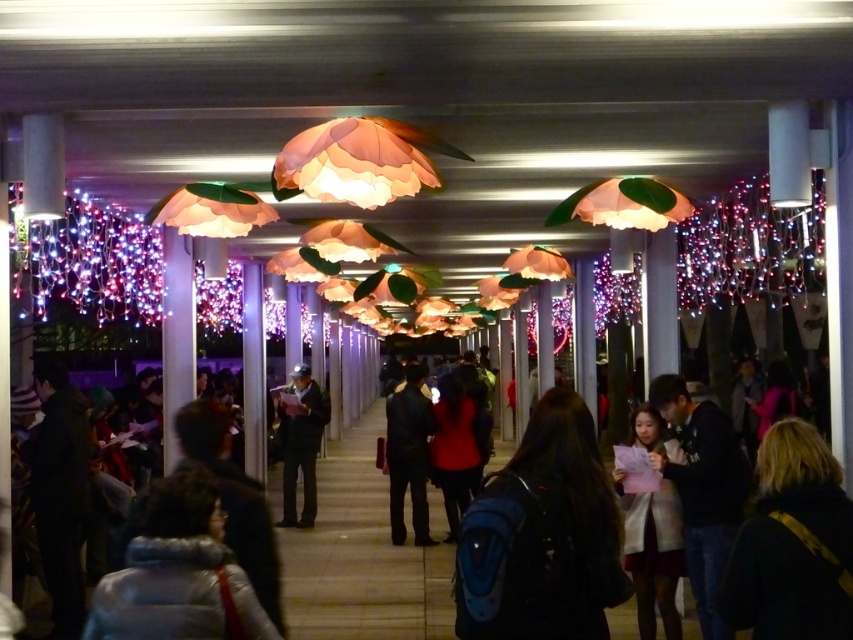
Which is more to the left, white puffy jacket at lower left or white matte coat at center?

Positioned to the left is white puffy jacket at lower left.

Is white puffy jacket at lower left positioned before white matte coat at center?

Yes.

Is point (115, 627) less distant than point (646, 435)?

Yes.

Where is `white puffy jacket at lower left`? Image resolution: width=853 pixels, height=640 pixels. white puffy jacket at lower left is located at coordinates pyautogui.click(x=178, y=572).

Does blue backpack at center appear under white puffy jacket at lower left?

Actually, blue backpack at center is above white puffy jacket at lower left.

Does blue backpack at center have a smaller size compared to white puffy jacket at lower left?

Indeed, blue backpack at center has a smaller size compared to white puffy jacket at lower left.

Find the location of a particular element. The width and height of the screenshot is (853, 640). blue backpack at center is located at coordinates (543, 536).

Is point (550, 573) positioned behind point (660, 612)?

No, (550, 573) is closer to viewer.

Who is taller, blue backpack at center or white matte coat at center?

With more height is white matte coat at center.

Between point (541, 556) and point (650, 428), which one is positioned behind?

The point (650, 428) is behind.

Where is `blue backpack at center`? blue backpack at center is located at coordinates (543, 536).